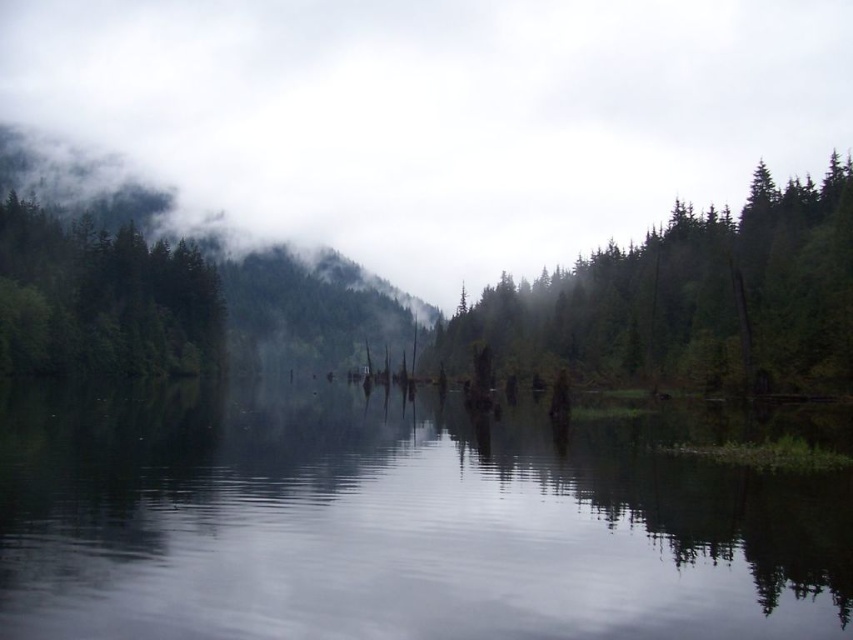
You are standing on a dock overlooking the scene. You see the smooth water at center and the white fluffy clouds at upper center. Which object is closer to you?

The smooth water at center is closer to you because it is in front of the white fluffy clouds at upper center.

From the picture: You are standing at the edge of the lake in the serene misty landscape. You notice two points marked on the image. Which point, point (206,616) or point (351,186), is nearer to your current position?

Point (206,616) is closer to the camera than point (351,186), so it is nearer to your current position.

You are a photographer standing at the lakeside. You want to take a photo that includes both the white fluffy clouds at upper center and the green matte tree at upper left. Given that your camera has a 50mm lens, which has a field of view that can capture about 45 degrees, can you fit both objects into the frame without moving your position?

The distance between the white fluffy clouds at upper center and the green matte tree at upper left is 252.64 meters. Since the camera lens has a 45 degree field of view, which can capture a wide enough angle to include both objects spaced 252.64 meters apart, you can fit both into the frame without moving.